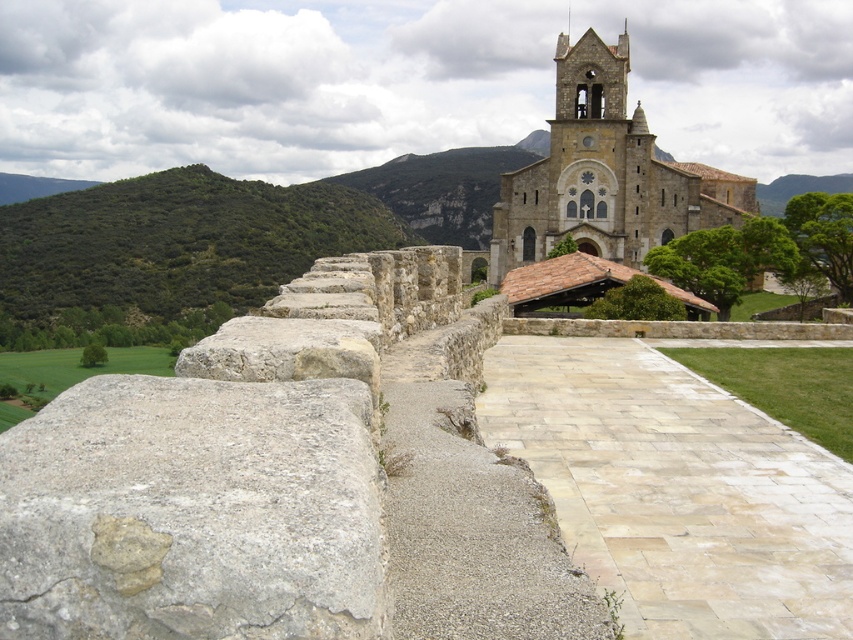
Question: Can you confirm if gray rough stone at left is smaller than stone church at center?

Choices:
 (A) no
 (B) yes

Answer: (B)

Question: Which object appears farthest from the camera in this image?

Choices:
 (A) gray rough stone at left
 (B) stone church at center

Answer: (B)

Question: Which of the following is the closest to the observer?

Choices:
 (A) (654, 208)
 (B) (364, 490)

Answer: (B)

Question: Does gray rough stone at left have a smaller size compared to stone church at center?

Choices:
 (A) yes
 (B) no

Answer: (A)

Question: Which object appears farthest from the camera in this image?

Choices:
 (A) gray rough stone at left
 (B) stone church at center

Answer: (B)

Question: From the image, what is the correct spatial relationship of gray rough stone at left in relation to stone church at center?

Choices:
 (A) right
 (B) left

Answer: (B)